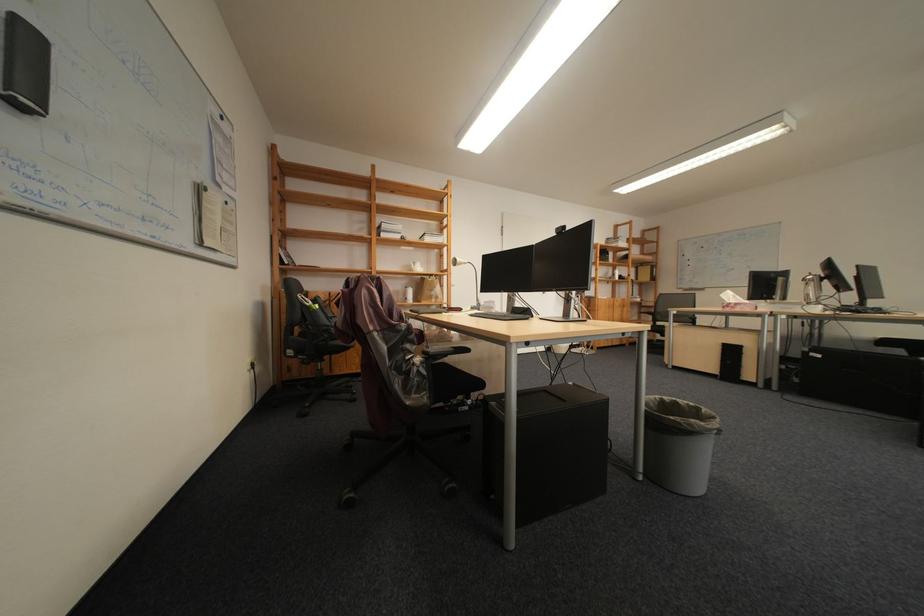
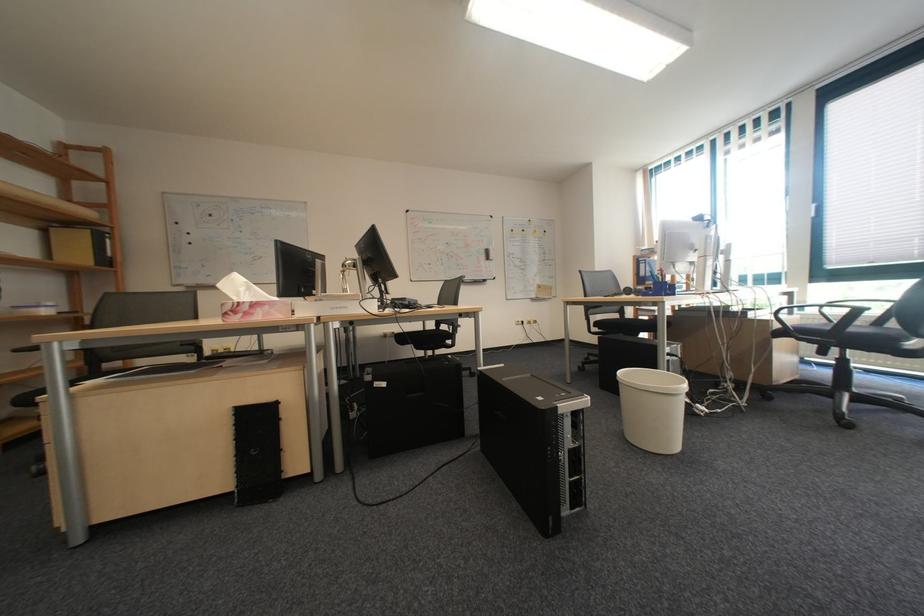
In the second image, find the point that corresponds to [833,358] in the first image.

(398, 386)